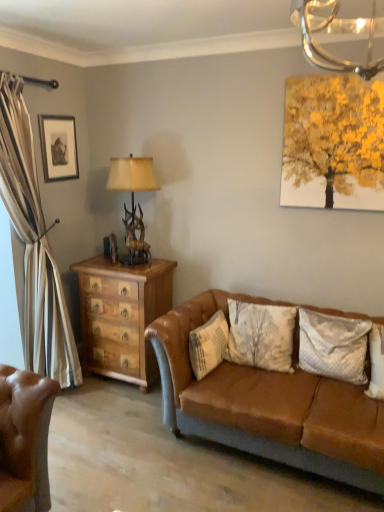
Question: From the image's perspective, is brown leather couch at center located above or below wooden chest of drawers at left?

Choices:
 (A) below
 (B) above

Answer: (A)

Question: Looking at the image, does brown leather couch at center seem bigger or smaller compared to wooden chest of drawers at left?

Choices:
 (A) big
 (B) small

Answer: (A)

Question: Which of these objects is positioned farthest from the white textured pillow at center, which appears as the 1th pillow when viewed from the left?

Choices:
 (A) antler-patterned wood table lamp at left
 (B) matte black frame at upper left
 (C) brown leather couch at center
 (D) wooden chest of drawers at left
 (E) velvety white pillow at center right, the 2th pillow when ordered from left to right

Answer: (B)

Question: Based on their relative distances, which object is nearer to the velvety white pillow at center right, the 1th pillow viewed from the right?

Choices:
 (A) matte black frame at upper left
 (B) brown leather couch at center
 (C) wooden chest of drawers at left
 (D) white textured pillow at center, which appears as the 1th pillow when viewed from the left
 (E) antler-patterned wood table lamp at left

Answer: (B)